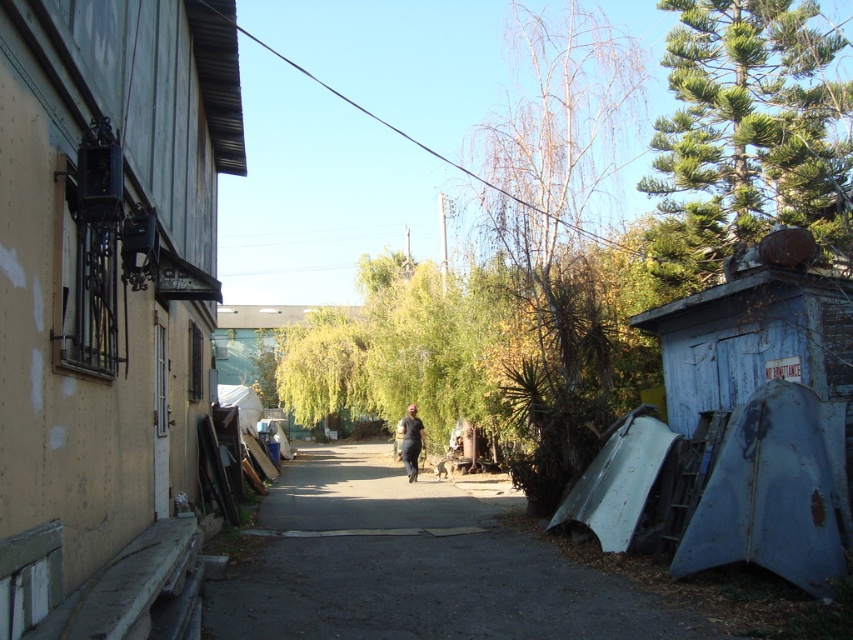
Question: Which point is closer to the camera taking this photo?

Choices:
 (A) (730, 243)
 (B) (469, 563)

Answer: (B)

Question: Can you confirm if green textured pine tree at upper right is smaller than dark gray fabric pants at center?

Choices:
 (A) yes
 (B) no

Answer: (B)

Question: Which point is farther to the camera?

Choices:
 (A) (737, 49)
 (B) (318, 604)

Answer: (A)

Question: Which point appears closest to the camera in this image?

Choices:
 (A) (791, 38)
 (B) (560, 340)
 (C) (415, 465)

Answer: (B)

Question: Can you confirm if bare branches at center is positioned below green textured pine tree at upper right?

Choices:
 (A) yes
 (B) no

Answer: (B)

Question: Is green textured pine tree at upper right closer to camera compared to dark gray fabric pants at center?

Choices:
 (A) no
 (B) yes

Answer: (B)